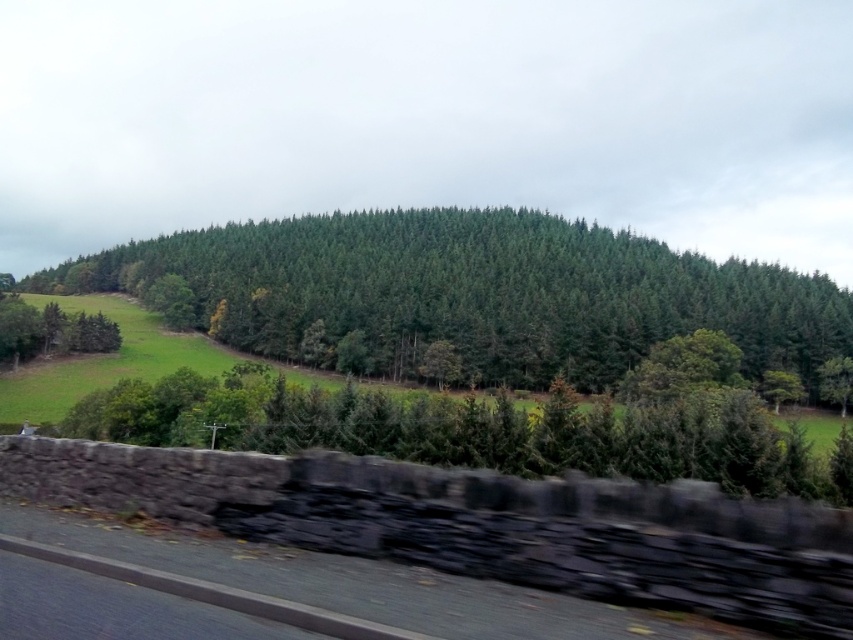
You are standing in the rural landscape and want to walk from the point closer to you to the point further away. Which path would you take between the two points, point(433, 248) and point(491, 636)?

The point closer to you is point(433, 248), so you would walk from point(433, 248) to point(491, 636).

You are a photographer planning to take a landscape photo that includes both the green matte forest at center and the black asphalt highway at lower left. Based on their heights, which object should you position closer to the center of your photo to emphasize its prominence?

The green matte forest at center is much taller than the black asphalt highway at lower left, so positioning it closer to the center of the photo will emphasize its prominence due to its greater height.

You are standing at the origin point of the image. Which direction should you move to reach the green matte forest at center?

The green matte forest at center is located at coordinates point [474,292], so you should move towards the center of the image to reach it.